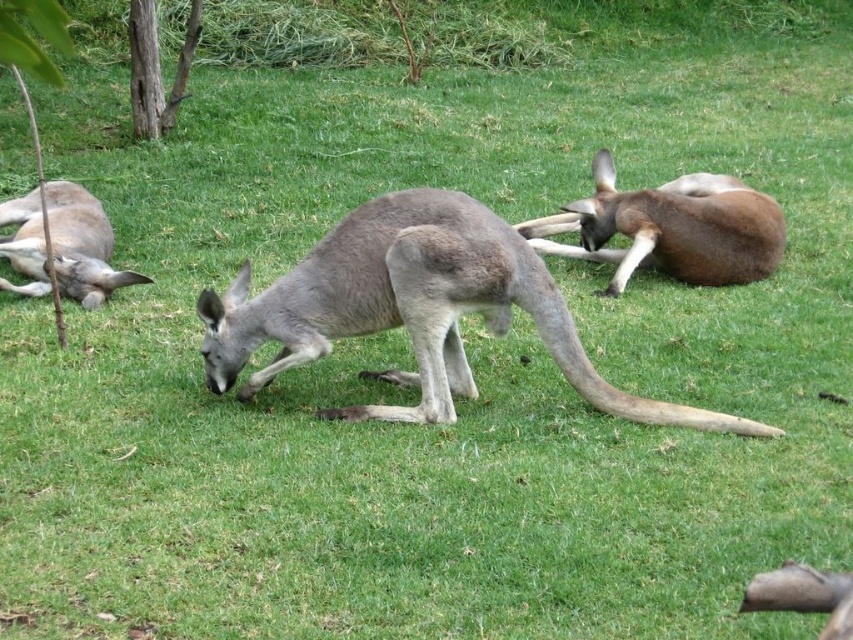
Does brown fur kangaroo at center have a greater height compared to gray fur kangaroo at left?

Yes.

Is brown fur kangaroo at center bigger than gray fur kangaroo at left?

Yes, brown fur kangaroo at center is bigger than gray fur kangaroo at left.

Identify the location of brown fur kangaroo at center. (670, 228).

Can you confirm if gray fur kangaroo at center is shorter than gray fur kangaroo at left?

In fact, gray fur kangaroo at center may be taller than gray fur kangaroo at left.

Between gray fur kangaroo at center and gray fur kangaroo at left, which one is positioned higher?

gray fur kangaroo at left is above.

Does point (457, 385) come in front of point (93, 250)?

Yes.

This screenshot has width=853, height=640. Find the location of `gray fur kangaroo at center`. gray fur kangaroo at center is located at coordinates (416, 310).

Describe the element at coordinates (416, 310) in the screenshot. The height and width of the screenshot is (640, 853). I see `gray fur kangaroo at center` at that location.

Who is lower down, gray fur kangaroo at center or brown fur kangaroo at center?

gray fur kangaroo at center is below.

Which is behind, point (364, 296) or point (622, 234)?

The point (622, 234) is more distant.

What are the coordinates of `gray fur kangaroo at center` in the screenshot? It's located at (416, 310).